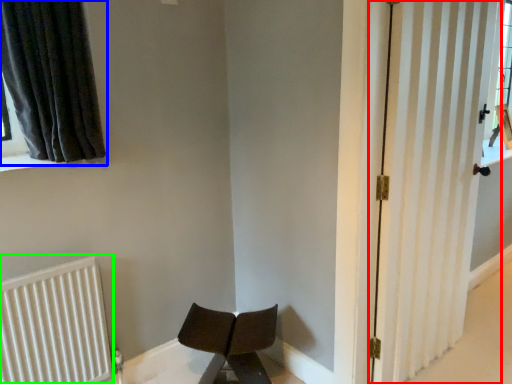
Question: Which is farther away from door (highlighted by a red box)? curtain (highlighted by a blue box) or radiator (highlighted by a green box)?

Choices:
 (A) curtain
 (B) radiator

Answer: (B)